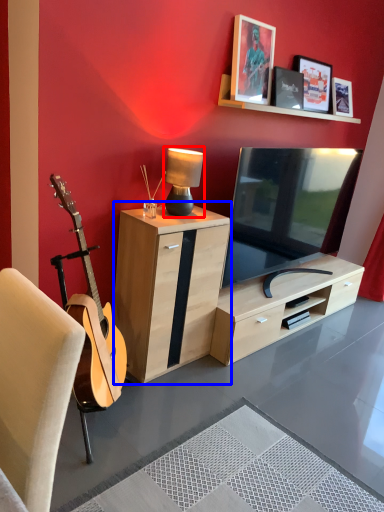
Question: Which of the following is the closest to the observer, table lamp (highlighted by a red box) or cabinetry (highlighted by a blue box)?

Choices:
 (A) table lamp
 (B) cabinetry

Answer: (B)